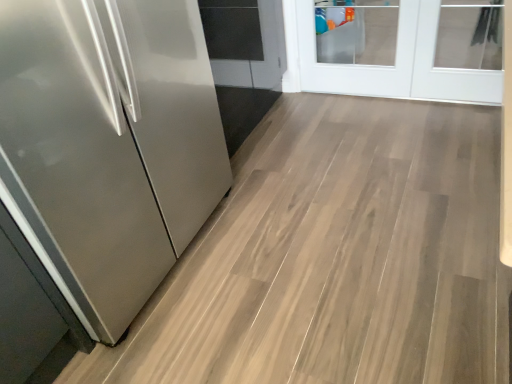
Question: Does white glass door at upper right have a smaller size compared to satin stainless steel refrigerator at left?

Choices:
 (A) no
 (B) yes

Answer: (B)

Question: Does white glass door at upper right appear on the left side of satin stainless steel refrigerator at left?

Choices:
 (A) no
 (B) yes

Answer: (A)

Question: Is satin stainless steel refrigerator at left at the back of white glass door at upper right?

Choices:
 (A) yes
 (B) no

Answer: (B)

Question: Is satin stainless steel refrigerator at left inside white glass door at upper right?

Choices:
 (A) no
 (B) yes

Answer: (A)

Question: Is the depth of white glass door at upper right less than that of satin stainless steel refrigerator at left?

Choices:
 (A) yes
 (B) no

Answer: (B)

Question: Is white glass door at upper right far away from satin stainless steel refrigerator at left?

Choices:
 (A) no
 (B) yes

Answer: (B)

Question: From the image's perspective, is satin stainless steel refrigerator at left below white glass door at upper right?

Choices:
 (A) yes
 (B) no

Answer: (A)

Question: Does satin stainless steel refrigerator at left come in front of white glass door at upper right?

Choices:
 (A) yes
 (B) no

Answer: (A)

Question: Can you confirm if satin stainless steel refrigerator at left is wider than white glass door at upper right?

Choices:
 (A) yes
 (B) no

Answer: (A)

Question: Would you say satin stainless steel refrigerator at left is outside white glass door at upper right?

Choices:
 (A) no
 (B) yes

Answer: (B)

Question: Would you say white glass door at upper right is part of satin stainless steel refrigerator at left's contents?

Choices:
 (A) no
 (B) yes

Answer: (A)

Question: Is satin stainless steel refrigerator at left taller than white glass door at upper right?

Choices:
 (A) yes
 (B) no

Answer: (A)

Question: Based on their sizes in the image, would you say satin stainless steel refrigerator at left is bigger or smaller than white glass door at upper right?

Choices:
 (A) small
 (B) big

Answer: (B)